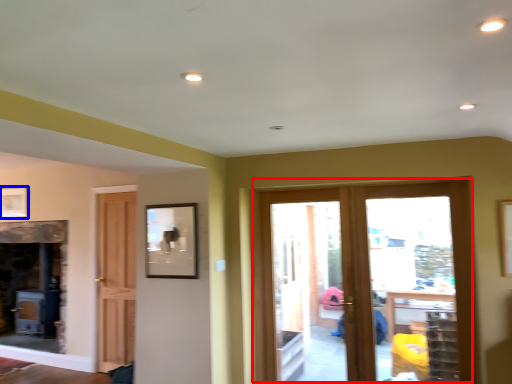
Question: Which point is closer to the camera, door (highlighted by a red box) or picture frame (highlighted by a blue box)?

Choices:
 (A) door
 (B) picture frame

Answer: (A)